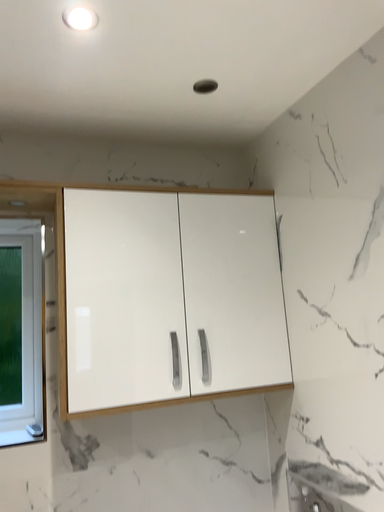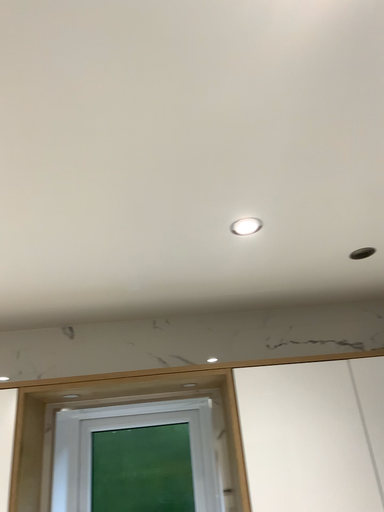
Question: Which way did the camera rotate in the video?

Choices:
 (A) rotated right
 (B) rotated left

Answer: (B)